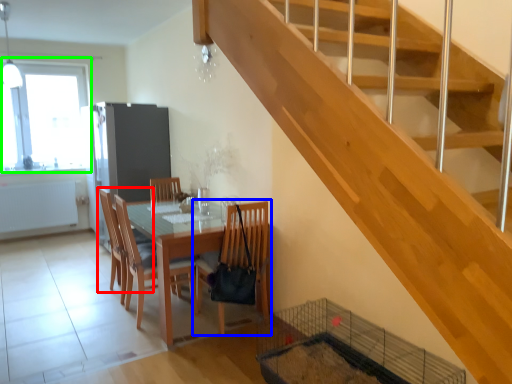
Question: Considering the real-world distances, which object is farthest from chair (highlighted by a red box)? chair (highlighted by a blue box) or window (highlighted by a green box)?

Choices:
 (A) chair
 (B) window

Answer: (B)